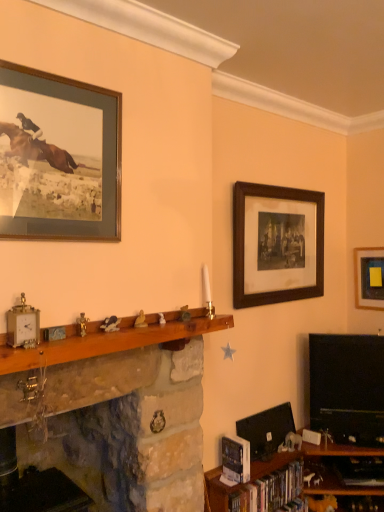
What do you see at coordinates (58, 157) in the screenshot?
I see `wooden framed print at upper left, the first picture frame from the front` at bounding box center [58, 157].

Locate an element on the screen. This screenshot has width=384, height=512. black glossy television at right is located at coordinates (347, 387).

Identify the location of wooden shelf at lower right, which is counted as the 1th shelf, starting from the right. (301, 478).

In order to click on wooden mantle at center, which is the 3th shelf from right to left in this screenshot , I will do `click(114, 411)`.

Describe the element at coordinates (369, 278) in the screenshot. This screenshot has width=384, height=512. I see `matte yellow paper at upper right, the 1th picture frame viewed from the back` at that location.

At what (x,y) coordinates should I click in order to perform the action: click on matte yellow paper at upper right, which appears as the first picture frame when viewed from the right. Please return your answer as a coordinate pair (x, y). Looking at the image, I should click on (369, 278).

Find the location of a particular element. Image resolution: width=384 pixels, height=512 pixels. wooden framed print at upper left, which is the 1th picture frame from left to right is located at coordinates (58, 157).

Is hardcover books at lower right wider or thinner than wooden at center, marked as the second shelf in a right-to-left arrangement?

hardcover books at lower right is thinner than wooden at center, marked as the second shelf in a right-to-left arrangement.

How many degrees apart are the facing directions of hardcover books at lower right and wooden at center, marked as the second shelf in a right-to-left arrangement?

hardcover books at lower right and wooden at center, marked as the second shelf in a right-to-left arrangement, are facing 0.759 degrees away from each other.

Does hardcover books at lower right contain wooden at center, arranged as the second shelf when viewed from the left?

No, wooden at center, arranged as the second shelf when viewed from the left, is located outside of hardcover books at lower right.

From a real-world perspective, between hardcover books at lower right and wooden at center, arranged as the second shelf when viewed from the left, who is vertically lower?

From a 3D spatial view, hardcover books at lower right is below.

Find the location of `the 1st shelf below the wooden at center, marked as the second shelf in a right-to-left arrangement (from a real-world perspective)`. the 1st shelf below the wooden at center, marked as the second shelf in a right-to-left arrangement (from a real-world perspective) is located at coordinates (114, 411).

Considering the points (134, 436) and (38, 345), which point is in front, point (134, 436) or point (38, 345)?

The point (38, 345) is closer to the camera.

Considering the positions of objects wooden mantle at center, acting as the 1th shelf starting from the left, and wooden at center, arranged as the second shelf when viewed from the left, in the image provided, who is more to the left, wooden mantle at center, acting as the 1th shelf starting from the left, or wooden at center, arranged as the second shelf when viewed from the left,?

wooden mantle at center, acting as the 1th shelf starting from the left.

How many degrees apart are the facing directions of wooden mantle at center, which is the 3th shelf from right to left, and wooden at center, marked as the second shelf in a right-to-left arrangement?

The angular difference between wooden mantle at center, which is the 3th shelf from right to left, and wooden at center, marked as the second shelf in a right-to-left arrangement, is 0.805 degrees.

Is black glossy television at right positioned with its back to wooden mantle at center, which is the 3th shelf from right to left?

black glossy television at right does not have its back to wooden mantle at center, which is the 3th shelf from right to left.

Is black glossy television at right bigger or smaller than wooden mantle at center, which is the 3th shelf from right to left?

Considering their sizes, black glossy television at right takes up less space than wooden mantle at center, which is the 3th shelf from right to left.

From the image's perspective, which object appears higher, black glossy television at right or wooden mantle at center, which is the 3th shelf from right to left?

black glossy television at right, from the image's perspective.

At what (x,y) coordinates should I click in order to perform the action: click on television above the wooden mantle at center, acting as the 1th shelf starting from the left (from the image's perspective). Please return your answer as a coordinate pair (x, y). This screenshot has width=384, height=512. Looking at the image, I should click on (347, 387).

Which of these two, matte yellow paper at upper right, which appears as the first picture frame when viewed from the right, or wooden framed print at upper right, which appears as the second picture frame when viewed from the front, stands shorter?

matte yellow paper at upper right, which appears as the first picture frame when viewed from the right, is shorter.

In the scene shown: Which object is positioned more to the right, matte yellow paper at upper right, the 1th picture frame viewed from the back, or wooden framed print at upper right, which appears as the second picture frame when viewed from the front?

Positioned to the right is matte yellow paper at upper right, the 1th picture frame viewed from the back.

Is matte yellow paper at upper right, the 3th picture frame from the left, bigger or smaller than wooden framed print at upper right, which appears as the second picture frame when viewed from the front?

Clearly, matte yellow paper at upper right, the 3th picture frame from the left, is smaller in size than wooden framed print at upper right, which appears as the second picture frame when viewed from the front.

Find the location of a particular element. The image size is (384, 512). book to the right of wooden framed print at upper left, the first picture frame from the front is located at coordinates (269, 490).

In terms of width, does wooden framed print at upper left, positioned as the 3th picture frame in back-to-front order, look wider or thinner when compared to hardcover books at lower right?

Clearly, wooden framed print at upper left, positioned as the 3th picture frame in back-to-front order, has less width compared to hardcover books at lower right.

Can you confirm if wooden framed print at upper left, positioned as the 3th picture frame in back-to-front order, is positioned to the right of hardcover books at lower right?

No, wooden framed print at upper left, positioned as the 3th picture frame in back-to-front order, is not to the right of hardcover books at lower right.

Which is in front, wooden framed print at upper left, positioned as the 3th picture frame in back-to-front order, or hardcover books at lower right?

wooden framed print at upper left, positioned as the 3th picture frame in back-to-front order, is closer to the camera.

Considering the relative positions of wooden framed print at upper right, positioned as the 2th picture frame in left-to-right order, and wooden framed print at upper left, which is the 1th picture frame from left to right, in the image provided, is wooden framed print at upper right, positioned as the 2th picture frame in left-to-right order, to the left of wooden framed print at upper left, which is the 1th picture frame from left to right, from the viewer's perspective?

No, wooden framed print at upper right, positioned as the 2th picture frame in left-to-right order, is not to the left of wooden framed print at upper left, which is the 1th picture frame from left to right.

Considering the relative sizes of wooden framed print at upper right, which is the 2th picture frame in back-to-front order, and wooden framed print at upper left, which is the 1th picture frame from left to right, in the image provided, is wooden framed print at upper right, which is the 2th picture frame in back-to-front order, bigger than wooden framed print at upper left, which is the 1th picture frame from left to right,?

Indeed, wooden framed print at upper right, which is the 2th picture frame in back-to-front order, has a larger size compared to wooden framed print at upper left, which is the 1th picture frame from left to right.

Consider the image. Is wooden framed print at upper right, which is the 2th picture frame in back-to-front order, wider than wooden framed print at upper left, acting as the third picture frame starting from the right?

Correct, the width of wooden framed print at upper right, which is the 2th picture frame in back-to-front order, exceeds that of wooden framed print at upper left, acting as the third picture frame starting from the right.

From a real-world perspective, is wooden framed print at upper right, which ranks as the second picture frame in right-to-left order, on wooden framed print at upper left, acting as the third picture frame starting from the right?

Incorrect, from a real-world perspective, wooden framed print at upper right, which ranks as the second picture frame in right-to-left order, is lower than wooden framed print at upper left, acting as the third picture frame starting from the right.

Could you tell me if hardcover books at lower right is facing wooden framed print at upper left, acting as the third picture frame starting from the right?

No.

Which of these two, hardcover books at lower right or wooden framed print at upper left, positioned as the 3th picture frame in back-to-front order, is smaller?

With smaller size is wooden framed print at upper left, positioned as the 3th picture frame in back-to-front order.

Considering the relative sizes of hardcover books at lower right and wooden framed print at upper left, which is the 1th picture frame from left to right, in the image provided, is hardcover books at lower right thinner than wooden framed print at upper left, which is the 1th picture frame from left to right,?

In fact, hardcover books at lower right might be wider than wooden framed print at upper left, which is the 1th picture frame from left to right.

Identify the location of book below the wooden at center, marked as the second shelf in a right-to-left arrangement (from a real-world perspective). The width and height of the screenshot is (384, 512). point(269,490).

Starting from the wooden mantle at center, acting as the 1th shelf starting from the left, which shelf is the 1st one to the right? Please provide its 2D coordinates.

[(111, 340)]

Considering their positions, is wooden framed print at upper left, positioned as the 3th picture frame in back-to-front order, positioned further to wooden mantle at center, acting as the 1th shelf starting from the left, than black glossy television at right?

The object further to wooden mantle at center, acting as the 1th shelf starting from the left, is black glossy television at right.

Which object lies further to the anchor point matte yellow paper at upper right, the 3th picture frame from the left, black glossy television at right or wooden framed print at upper left, which is the 1th picture frame from left to right?

Among the two, wooden framed print at upper left, which is the 1th picture frame from left to right, is located further to matte yellow paper at upper right, the 3th picture frame from the left.

Considering their positions, is matte yellow paper at upper right, the 3th picture frame from the left, positioned further to wooden shelf at lower right, which is counted as the 1th shelf, starting from the right, than hardcover books at lower right?

matte yellow paper at upper right, the 3th picture frame from the left, is further to wooden shelf at lower right, which is counted as the 1th shelf, starting from the right.

Looking at the image, which one is located further to wooden shelf at lower right, arranged as the 3th shelf when viewed from the left, wooden framed print at upper right, positioned as the 2th picture frame in left-to-right order, or hardcover books at lower right?

Among the two, wooden framed print at upper right, positioned as the 2th picture frame in left-to-right order, is located further to wooden shelf at lower right, arranged as the 3th shelf when viewed from the left.

From the image, which object appears to be nearer to wooden framed print at upper left, the first picture frame from the front, wooden at center, marked as the second shelf in a right-to-left arrangement, or wooden mantle at center, acting as the 1th shelf starting from the left?

wooden at center, marked as the second shelf in a right-to-left arrangement, is positioned closer to the anchor wooden framed print at upper left, the first picture frame from the front.

Considering their positions, is matte yellow paper at upper right, placed as the 3th picture frame when sorted from front to back, positioned closer to hardcover books at lower right than wooden at center, arranged as the second shelf when viewed from the left?

wooden at center, arranged as the second shelf when viewed from the left.

Looking at the image, which one is located further to wooden framed print at upper left, acting as the third picture frame starting from the right, wooden shelf at lower right, which is counted as the 1th shelf, starting from the right, or matte yellow paper at upper right, the 3th picture frame from the left?

Based on the image, matte yellow paper at upper right, the 3th picture frame from the left, appears to be further to wooden framed print at upper left, acting as the third picture frame starting from the right.

Which object lies further to the anchor point hardcover books at lower right, black glossy television at right or wooden framed print at upper right, positioned as the 2th picture frame in left-to-right order?

Among the two, wooden framed print at upper right, positioned as the 2th picture frame in left-to-right order, is located further to hardcover books at lower right.

Where is `television that lies between wooden framed print at upper right, which is the 2th picture frame in back-to-front order, and hardcover books at lower right from top to bottom`? The image size is (384, 512). television that lies between wooden framed print at upper right, which is the 2th picture frame in back-to-front order, and hardcover books at lower right from top to bottom is located at coordinates (347, 387).

Where is `picture frame between wooden at center, arranged as the second shelf when viewed from the left, and wooden framed print at upper right, which is the 2th picture frame in back-to-front order, along the z-axis`? Image resolution: width=384 pixels, height=512 pixels. picture frame between wooden at center, arranged as the second shelf when viewed from the left, and wooden framed print at upper right, which is the 2th picture frame in back-to-front order, along the z-axis is located at coordinates click(58, 157).

You are a GUI agent. You are given a task and a screenshot of the screen. Output one action in this format:
    pyautogui.click(x=<x>, y=<y>)
    Task: Click on the picture frame between wooden framed print at upper right, positioned as the 2th picture frame in left-to-right order, and black glossy television at right in the up-down direction
    Image resolution: width=384 pixels, height=512 pixels.
    Given the screenshot: What is the action you would take?
    pyautogui.click(x=369, y=278)

Locate an element on the screen. The height and width of the screenshot is (512, 384). picture frame situated between wooden framed print at upper left, which is the 1th picture frame from left to right, and matte yellow paper at upper right, which appears as the first picture frame when viewed from the right, from left to right is located at coordinates (277, 244).